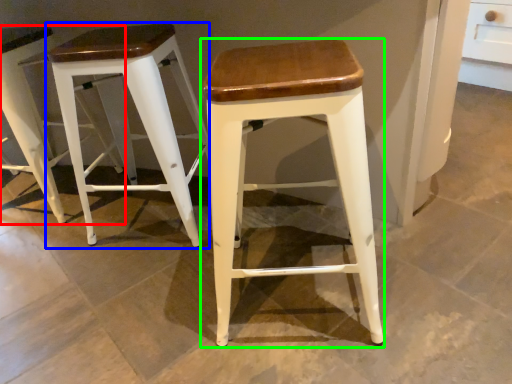
Question: Considering the real-world distances, which object is farthest from stool (highlighted by a red box)? stool (highlighted by a blue box) or stool (highlighted by a green box)?

Choices:
 (A) stool
 (B) stool

Answer: (B)